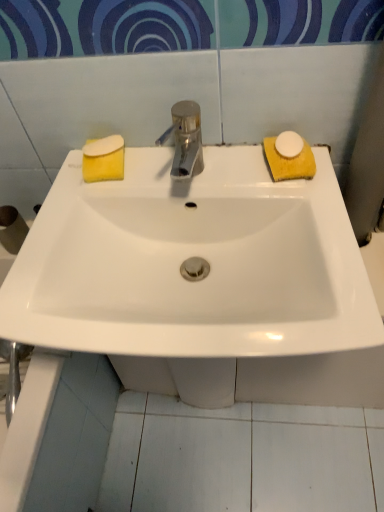
At what (x,y) coordinates should I click in order to perform the action: click on vacant area that lies between yellow sponge at left, the 1th soap in the left-to-right sequence, and white matte soap at right, arranged as the third soap when viewed from the left. Please return your answer as a coordinate pair (x, y). Looking at the image, I should click on (198, 168).